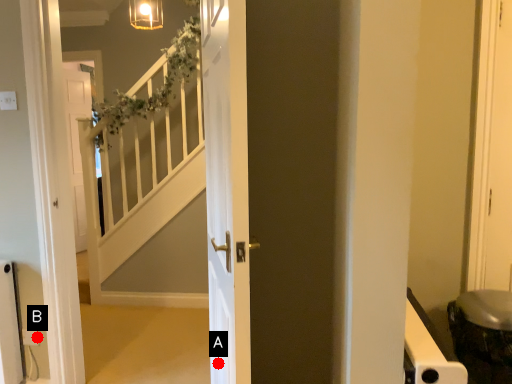
Question: Two points are circled on the image, labeled by A and B beside each circle. Which point is closer to the camera?

Choices:
 (A) A is closer
 (B) B is closer

Answer: (A)